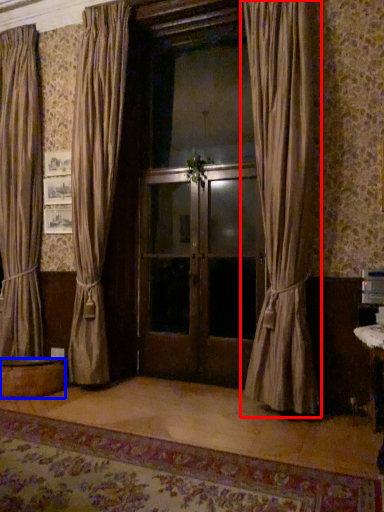
Question: Which object is closer to the camera taking this photo, curtain (highlighted by a red box) or round table (highlighted by a blue box)?

Choices:
 (A) curtain
 (B) round table

Answer: (A)